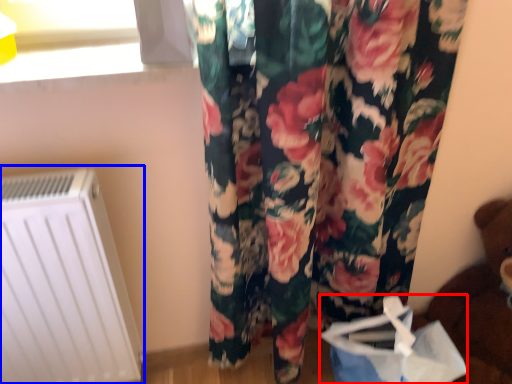
Question: Among these objects, which one is nearest to the camera, shopping bag (highlighted by a red box) or radiator (highlighted by a blue box)?

Choices:
 (A) shopping bag
 (B) radiator

Answer: (B)